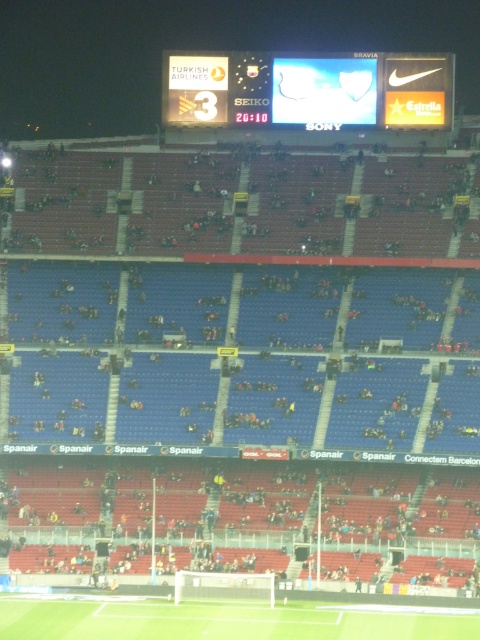
Is point (181, 122) farther from viewer compared to point (64, 632)?

Yes, point (181, 122) is behind point (64, 632).

Can you confirm if white glossy scoreboard at upper center is positioned to the left of green grass football field at lower center?

Incorrect, white glossy scoreboard at upper center is not on the left side of green grass football field at lower center.

You are a GUI agent. You are given a task and a screenshot of the screen. Output one action in this format:
    pyautogui.click(x=<x>, y=<y>)
    Task: Click on the white glossy scoreboard at upper center
    
    Given the screenshot: What is the action you would take?
    [x=310, y=90]

This screenshot has height=640, width=480. I want to click on white glossy scoreboard at upper center, so click(310, 90).